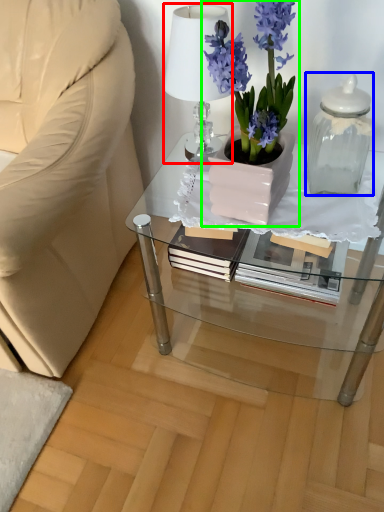
Question: Considering the real-world distances, which object is closest to lamp (highlighted by a red box)? bottle (highlighted by a blue box) or houseplant (highlighted by a green box).

Choices:
 (A) bottle
 (B) houseplant

Answer: (B)